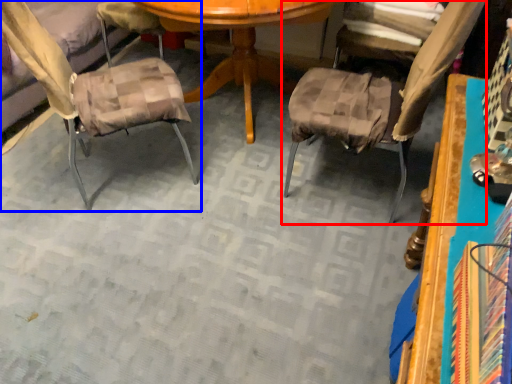
Question: Which object appears closest to the camera in this image, chair (highlighted by a red box) or chair (highlighted by a blue box)?

Choices:
 (A) chair
 (B) chair

Answer: (A)